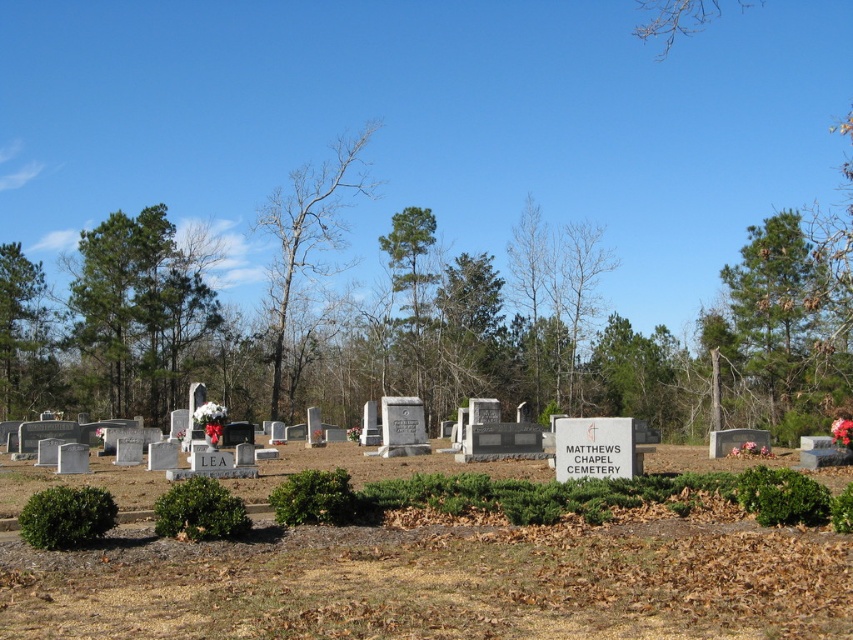
Question: Which point appears closest to the camera in this image?

Choices:
 (A) (819, 314)
 (B) (279, 381)

Answer: (A)

Question: Can you confirm if green leafy tree at upper right is wider than bare wood tree at center?

Choices:
 (A) yes
 (B) no

Answer: (B)

Question: Is green leafy tree at upper right bigger than bare wood tree at center?

Choices:
 (A) yes
 (B) no

Answer: (B)

Question: Estimate the real-world distances between objects in this image. Which object is farther from the green leafy tree at center?

Choices:
 (A) bare wood tree at center
 (B) green leafy tree at left

Answer: (B)

Question: Which object is positioned closest to the bare wood tree at center?

Choices:
 (A) green leafy tree at left
 (B) green leafy tree at center

Answer: (B)

Question: Can you confirm if green leafy tree at upper right is wider than green leafy tree at left?

Choices:
 (A) no
 (B) yes

Answer: (B)